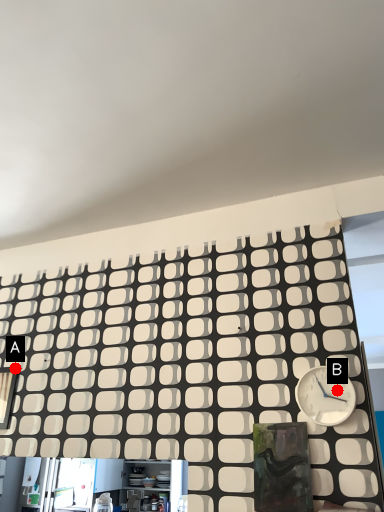
Question: Two points are circled on the image, labeled by A and B beside each circle. Which of the following is the closest to the observer?

Choices:
 (A) A is closer
 (B) B is closer

Answer: (B)